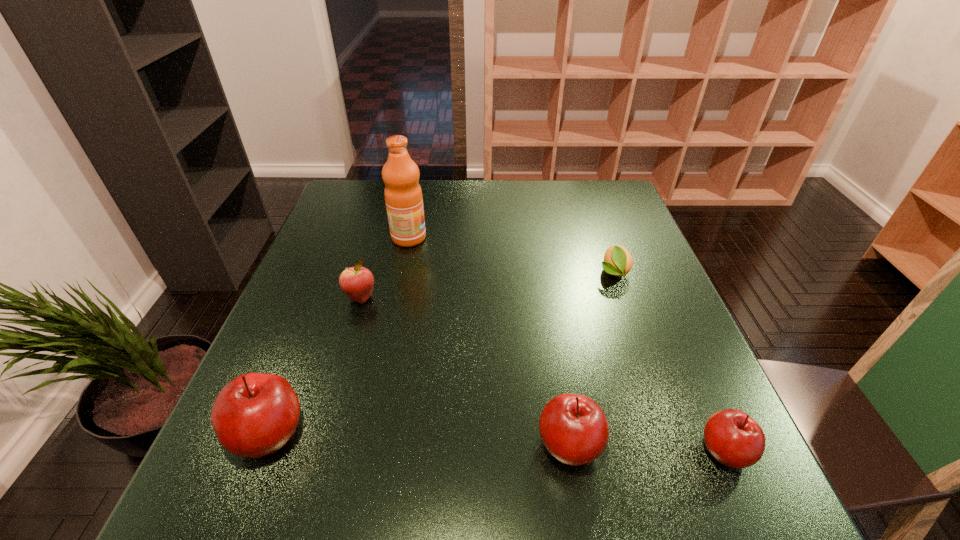
Locate an element on the screen. The height and width of the screenshot is (540, 960). empty space that is in between the tallest object and the farthest apple is located at coordinates [385, 268].

The height and width of the screenshot is (540, 960). Find the location of `empty space between the shortest object and the farthest apple`. empty space between the shortest object and the farthest apple is located at coordinates (487, 285).

Select which object appears as the second closest to the fourth object from left to right. Please provide its 2D coordinates. Your answer should be formatted as a tuple, i.e. [(x, y)], where the tuple contains the x and y coordinates of a point satisfying the conditions above.

[(618, 261)]

This screenshot has height=540, width=960. I want to click on object that is the third closest one to the fifth shortest object, so click(403, 196).

Select which apple is the second closest to the farthest apple. Please provide its 2D coordinates. Your answer should be formatted as a tuple, i.e. [(x, y)], where the tuple contains the x and y coordinates of a point satisfying the conditions above.

[(574, 429)]

Locate an element on the screen. The image size is (960, 540). the third closest apple to the farthest object is located at coordinates (574, 429).

Identify the location of free space that satisfies the following two spatial constraints: 1. on the label side of the farthest object; 2. on the left side of the second shortest object. (365, 451).

At what (x,y) coordinates should I click in order to perform the action: click on free location that satisfies the following two spatial constraints: 1. on the front side of the third object from right to left; 2. on the right side of the fifth tallest object. Please return your answer as a coordinate pair (x, y). Looking at the image, I should click on (570, 451).